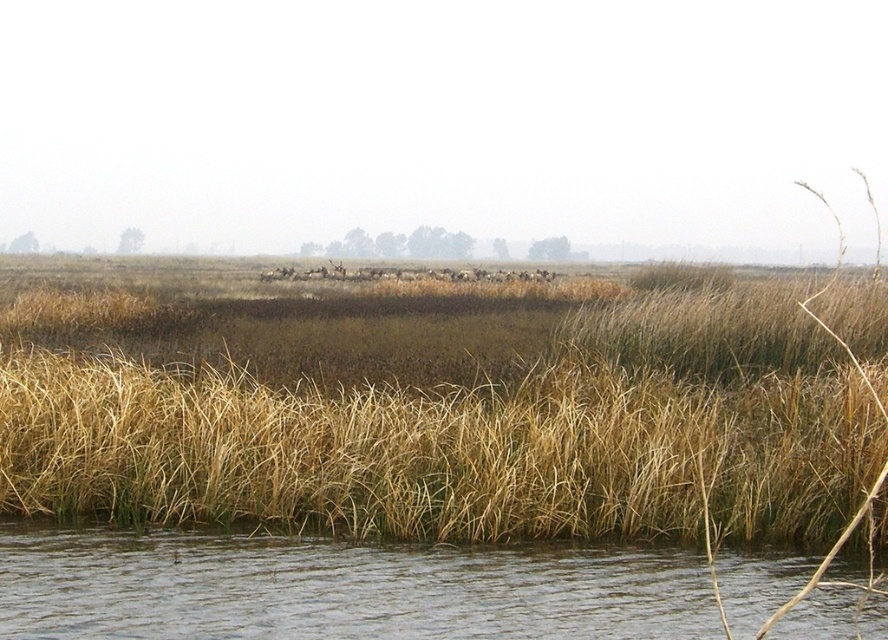
You are a wildlife photographer aiming to capture both the dry grass at center and the brown fuzzy deer at center in a single frame. Given that your camera can only focus on objects wider than 50 cm, will both objects meet the focus requirement?

The dry grass at center has a width larger than 50 cm since its width is larger than the brown fuzzy deer at center. However, the brown fuzzy deer at center might be smaller than 50 cm in width. Therefore, only the dry grass at center will meet the focus requirement.

You are standing at the origin point of the coordinate system in this wetland scene. You need to locate the dry grass at center. What are the exact coordinates where you should look to find it?

The dry grass at center is located at the coordinates point [437,419].

You are standing at the edge of the wetland and want to reach a specific point in the scene marked as point (457, 627). If you start walking straight ahead from your current position, will you reach that point without deviating? Explain your reasoning based on the scene description.

The point (457, 627) is 31.39 feet away from the viewer. Since the scene describes an open wetland with water and grasses in the foreground and midground, and the herd of animals in the background, the path to the point is likely unobstructed. Therefore, walking straight ahead should allow you to reach the point without deviating.